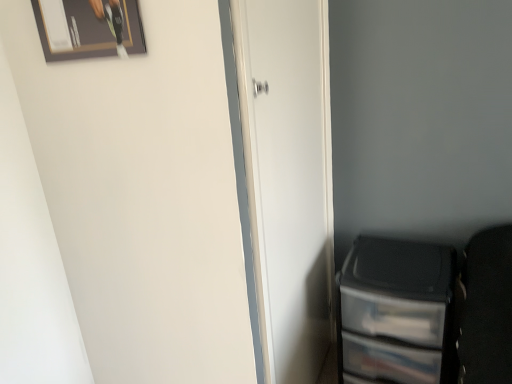
Question: From the image's perspective, relative to wooden framed picture at upper left, is transparent plastic file cabinet at lower right above or below?

Choices:
 (A) above
 (B) below

Answer: (B)

Question: Based on their sizes in the image, would you say transparent plastic file cabinet at lower right is bigger or smaller than wooden framed picture at upper left?

Choices:
 (A) small
 (B) big

Answer: (B)

Question: Which of these objects is positioned closest to the wooden framed picture at upper left?

Choices:
 (A) transparent plastic file cabinet at lower right
 (B) white matte door at center

Answer: (B)

Question: Considering the real-world distances, which object is closest to the transparent plastic file cabinet at lower right?

Choices:
 (A) wooden framed picture at upper left
 (B) white matte door at center

Answer: (B)